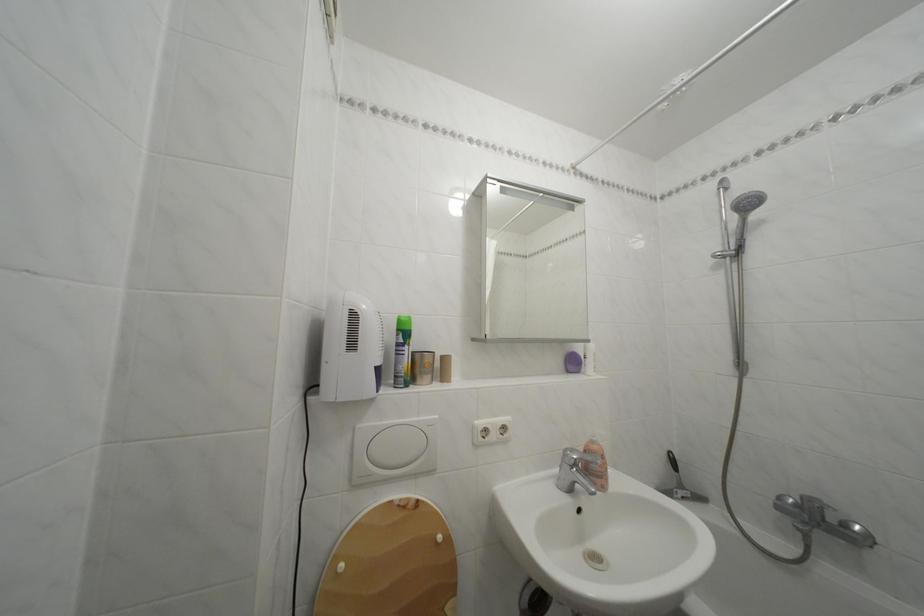
The image size is (924, 616). Find the location of `toilet flush button`. toilet flush button is located at coordinates pos(393,450).